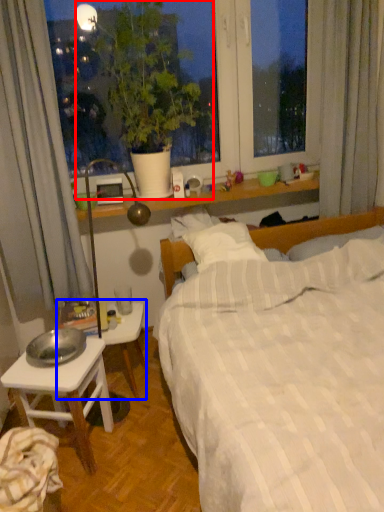
Question: Which object appears closest to the camera in this image, houseplant (highlighted by a red box) or table (highlighted by a blue box)?

Choices:
 (A) houseplant
 (B) table

Answer: (A)